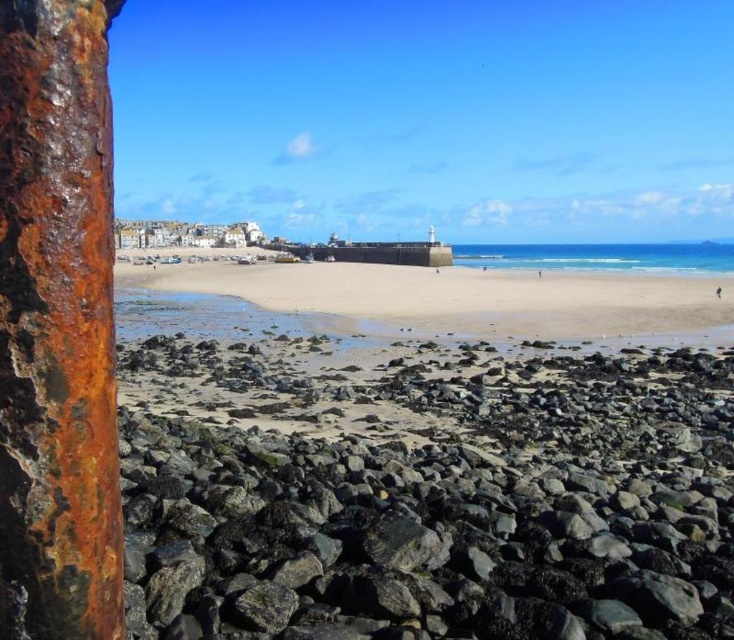
Looking at this image, who is taller, rusty metal pole at left or smooth sand at center?

rusty metal pole at left

Who is more distant from viewer, (103, 44) or (531, 301)?

Point (531, 301)

Identify the location of rusty metal pole at left. The width and height of the screenshot is (734, 640). (57, 324).

Does smooth sand at center have a lesser width compared to blue glossy water at center?

Incorrect, smooth sand at center's width is not less than blue glossy water at center's.

Does point (200, 285) come in front of point (472, 248)?

Yes, it is in front of point (472, 248).

The width and height of the screenshot is (734, 640). What do you see at coordinates (421, 300) in the screenshot?
I see `smooth sand at center` at bounding box center [421, 300].

Image resolution: width=734 pixels, height=640 pixels. I want to click on smooth sand at center, so click(x=421, y=300).

Locate an element on the screen. This screenshot has height=640, width=734. rusty metal pole at left is located at coordinates (57, 324).

Is rusty metal pole at left closer to camera compared to blue glossy water at center?

Yes, rusty metal pole at left is in front of blue glossy water at center.

Is point (115, 529) less distant than point (523, 244)?

Yes, it is.

Where is `rusty metal pole at left`? rusty metal pole at left is located at coordinates (57, 324).